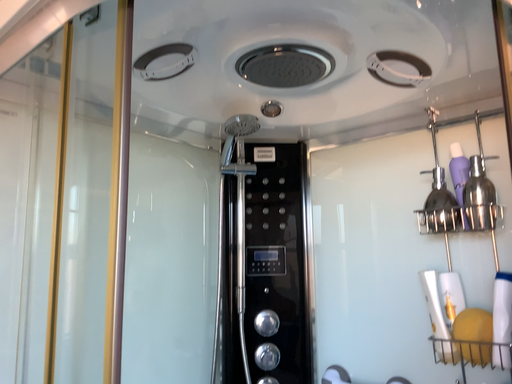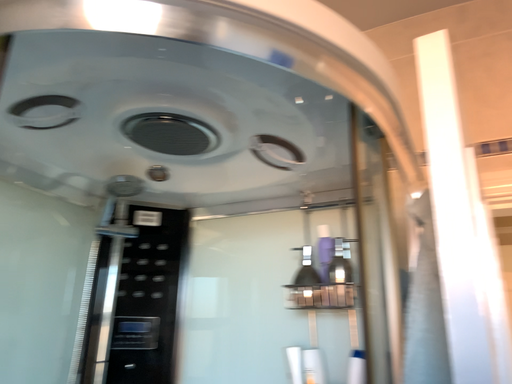
Question: How did the camera likely rotate when shooting the video?

Choices:
 (A) rotated downward
 (B) rotated upward

Answer: (B)